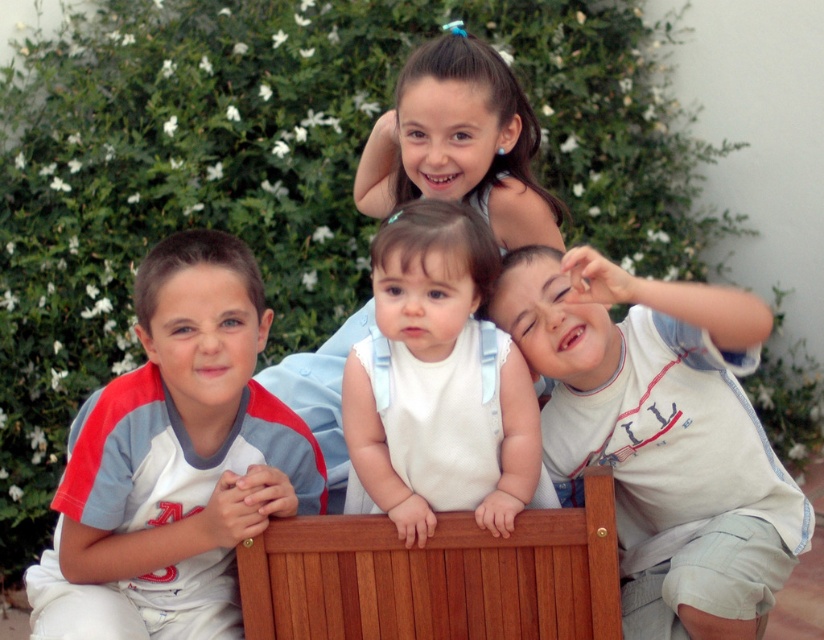
Question: Which point is farther from the camera taking this photo?

Choices:
 (A) (439, 417)
 (B) (232, 323)
 (C) (286, 636)
 (D) (801, 502)

Answer: (D)

Question: Based on their relative distances, which object is nearer to the white fabric dress at center?

Choices:
 (A) light blue fabric shirt at left
 (B) white cotton shirt at right
 (C) smooth blue dress at upper center

Answer: (B)

Question: Which of these objects is positioned closest to the light blue fabric shirt at left?

Choices:
 (A) smooth blue dress at upper center
 (B) white cotton shirt at right

Answer: (A)

Question: Can you confirm if white cotton shirt at right is positioned above wooden bench at center?

Choices:
 (A) yes
 (B) no

Answer: (A)

Question: Is white cotton shirt at right below smooth blue dress at upper center?

Choices:
 (A) yes
 (B) no

Answer: (A)

Question: Does white fabric dress at center lie in front of smooth blue dress at upper center?

Choices:
 (A) no
 (B) yes

Answer: (B)